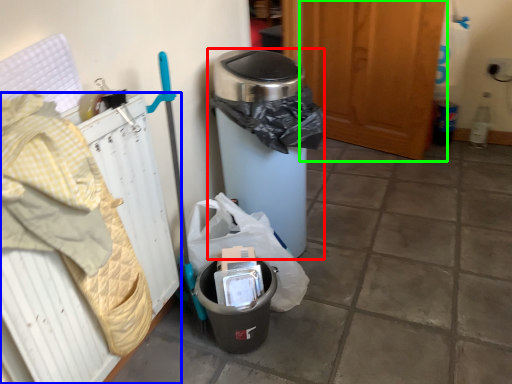
Question: Considering the real-world distances, which object is closest to waste container (highlighted by a red box)? radiator (highlighted by a blue box) or screen door (highlighted by a green box).

Choices:
 (A) radiator
 (B) screen door

Answer: (A)